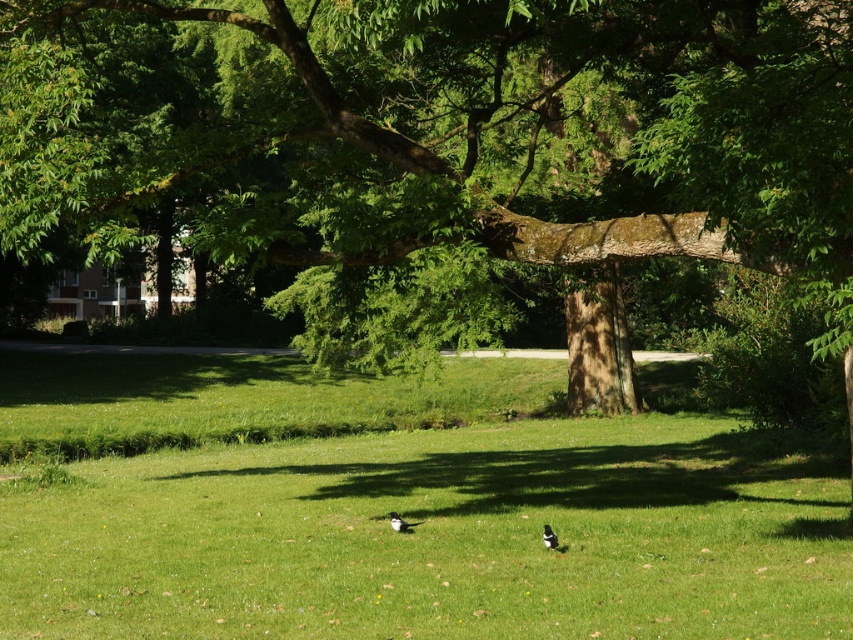
Question: Is green grassy field at center bigger than white glossy bird at center?

Choices:
 (A) no
 (B) yes

Answer: (B)

Question: Which point is farther to the camera?

Choices:
 (A) (827, 340)
 (B) (305, 632)
 (C) (393, 524)
 (D) (550, 540)

Answer: (C)

Question: Can you confirm if green leafy tree at center is thinner than black glossy bird at center?

Choices:
 (A) yes
 (B) no

Answer: (B)

Question: Is green leafy tree at center below white glossy bird at center?

Choices:
 (A) no
 (B) yes

Answer: (A)

Question: Which object is the closest to the white glossy bird at center?

Choices:
 (A) black glossy bird at center
 (B) green grassy field at center

Answer: (A)

Question: Which point is farther from the camera taking this photo?

Choices:
 (A) (793, 35)
 (B) (548, 529)
 (C) (396, 513)

Answer: (C)